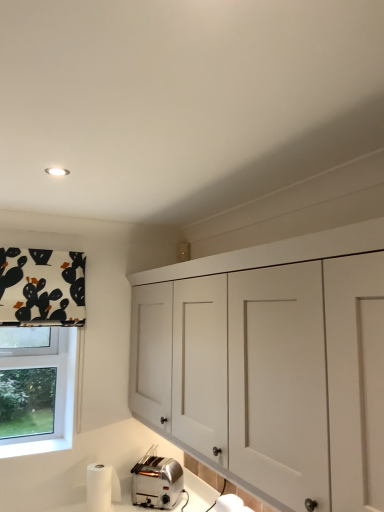
Question: Considering the relative sizes of white fabric with black and orange shapes at upper left and satin silver toaster at lower left in the image provided, is white fabric with black and orange shapes at upper left shorter than satin silver toaster at lower left?

Choices:
 (A) yes
 (B) no

Answer: (B)

Question: Does white fabric with black and orange shapes at upper left lie in front of satin silver toaster at lower left?

Choices:
 (A) no
 (B) yes

Answer: (B)

Question: Does white fabric with black and orange shapes at upper left have a smaller size compared to satin silver toaster at lower left?

Choices:
 (A) no
 (B) yes

Answer: (A)

Question: Could you tell me if white fabric with black and orange shapes at upper left is turned towards satin silver toaster at lower left?

Choices:
 (A) yes
 (B) no

Answer: (B)

Question: Does white fabric with black and orange shapes at upper left come behind satin silver toaster at lower left?

Choices:
 (A) no
 (B) yes

Answer: (A)

Question: From a real-world perspective, is white fabric with black and orange shapes at upper left positioned over satin silver toaster at lower left based on gravity?

Choices:
 (A) yes
 (B) no

Answer: (A)

Question: Is satin silver toaster at lower left to the right of white matte cabinet at upper center from the viewer's perspective?

Choices:
 (A) no
 (B) yes

Answer: (A)

Question: From the image's perspective, does satin silver toaster at lower left appear lower than white matte cabinet at upper center?

Choices:
 (A) no
 (B) yes

Answer: (B)

Question: From a real-world perspective, is satin silver toaster at lower left positioned under white matte cabinet at upper center based on gravity?

Choices:
 (A) yes
 (B) no

Answer: (A)

Question: Is satin silver toaster at lower left shorter than white matte cabinet at upper center?

Choices:
 (A) yes
 (B) no

Answer: (A)

Question: Is satin silver toaster at lower left bigger than white matte cabinet at upper center?

Choices:
 (A) no
 (B) yes

Answer: (A)

Question: Can you confirm if satin silver toaster at lower left is wider than white matte cabinet at upper center?

Choices:
 (A) yes
 (B) no

Answer: (B)

Question: Can you confirm if satin silver toaster at lower left is shorter than white fabric with black and orange shapes at upper left?

Choices:
 (A) yes
 (B) no

Answer: (A)